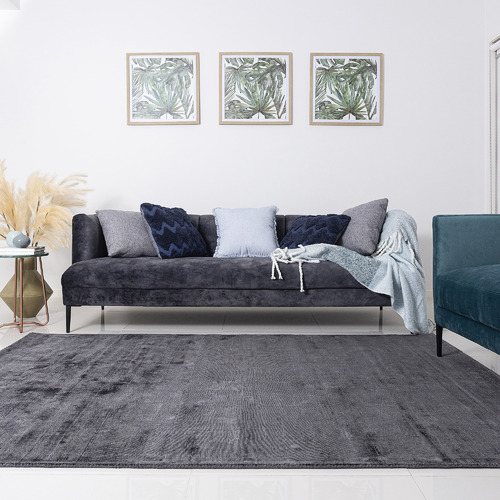
This screenshot has width=500, height=500. I want to click on books, so click(16, 248).